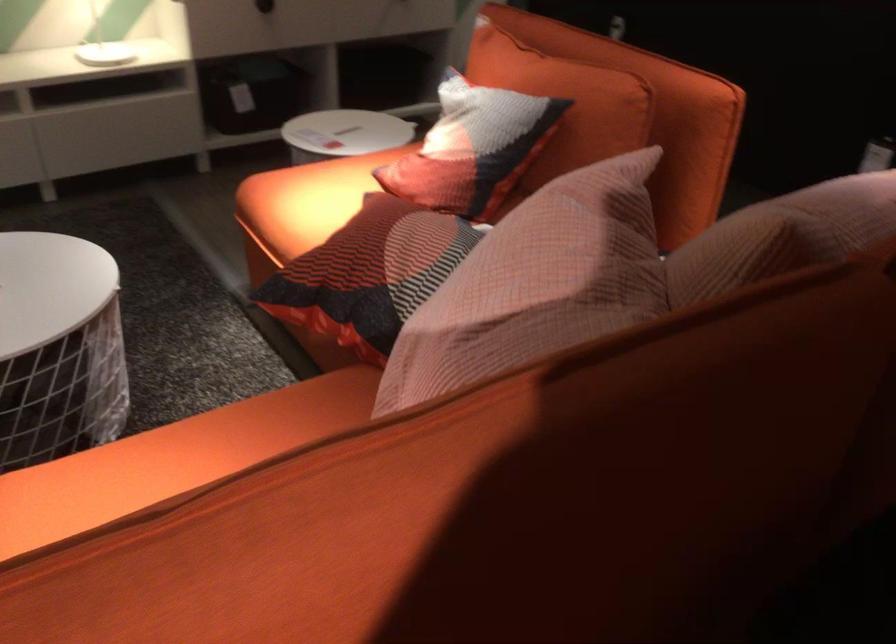
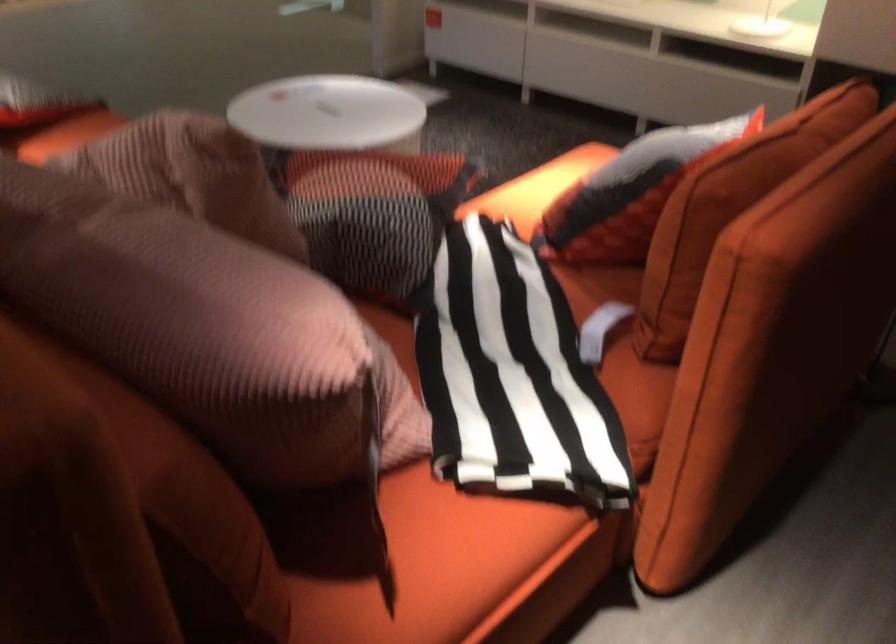
Question: I am providing you with two images of the same scene from different viewpoints. Please identify which objects are invisible in image2.

Choices:
 (A) patterned throw pillow
 (B) black patterned pillow
 (C) sofa sitting surface
 (D) metal shaker bottle

Answer: (A)